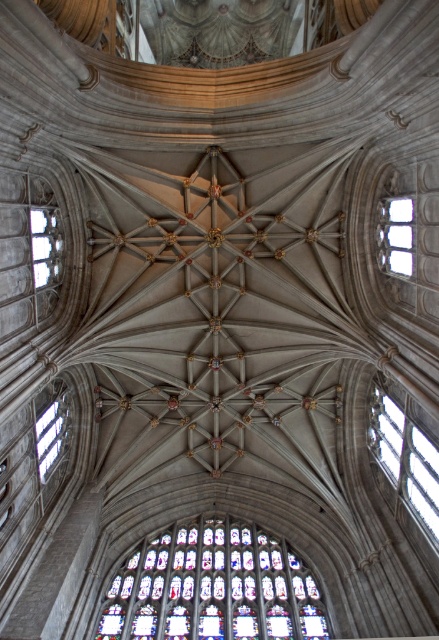
Does clear glass window at right appear on the left side of clear glass window at upper right?

In fact, clear glass window at right is to the right of clear glass window at upper right.

Who is higher up, clear glass window at right or clear glass window at upper right?

clear glass window at upper right

Which is in front, point (431, 541) or point (399, 269)?

Point (431, 541) is more forward.

This screenshot has width=439, height=640. I want to click on clear glass window at right, so click(x=406, y=461).

Can you confirm if stained glass window at center is thinner than clear glass window at center?

In fact, stained glass window at center might be wider than clear glass window at center.

This screenshot has width=439, height=640. Find the location of `stained glass window at center`. stained glass window at center is located at coordinates (213, 588).

Can you confirm if clear glass window at left is positioned to the right of clear glass window at center?

Correct, you'll find clear glass window at left to the right of clear glass window at center.

Who is more distant from viewer, (x=33, y=212) or (x=51, y=449)?

The point (x=51, y=449) is more distant.

Find the location of `clear glass window at left`. clear glass window at left is located at coordinates (45, 244).